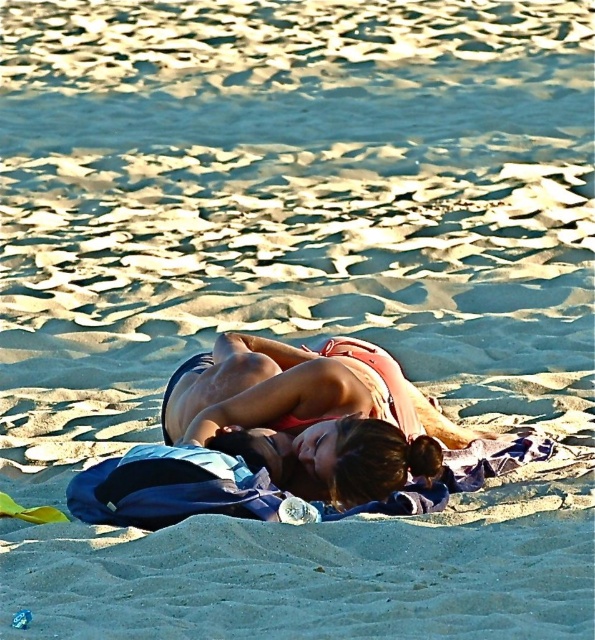
In the scene shown: You are a photographer taking a picture of the beach scene. You want to focus on the pink fabric bikini at center. Where exactly should you point your camera to capture it?

You should point your camera at point coordinates of (311, 413) to capture the pink fabric bikini at center.

You are a photographer trying to capture both the pink fabric bikini at center and the matte pink bikini at center in a single shot. Which one will appear closer to the camera in the photo?

The pink fabric bikini at center will appear closer to the camera because it is positioned further to the viewer than the matte pink bikini at center.

You are a photographer at the beach. You need to capture a photo that includes both the pink fabric bikini at center and the matte pink bikini at center. Which one should you focus on first to ensure it appears larger in the photo?

The pink fabric bikini at center is taller than the matte pink bikini at center, so focusing on it first will ensure it appears larger in the photo.